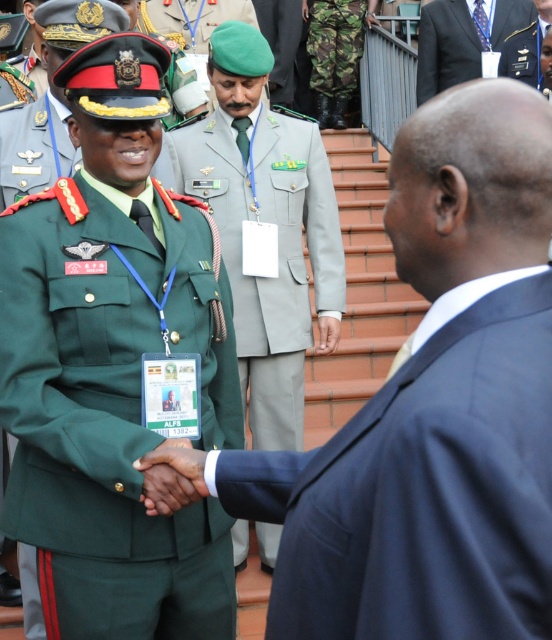
You are at the origin point in the image. You want to move towards the green matte uniform at center. Which direction should you move in terms of x and y coordinates?

The green matte uniform at center is located at coordinates x 0.580 and y 0.192, so you should move towards the positive x and positive y direction.

Based on the photo, you are a photographer at the event and need to capture a closeup shot of both the green matte uniform at center and the green military uniform at center. Given that your camera has a maximum focus range of 6 meters, will you be able to photograph both subjects clearly?

The green matte uniform at center is 7.17 meters away from the green military uniform at center. Since the camera can only focus up to 6 meters, the distance between them is too great to capture both clearly in the same shot.